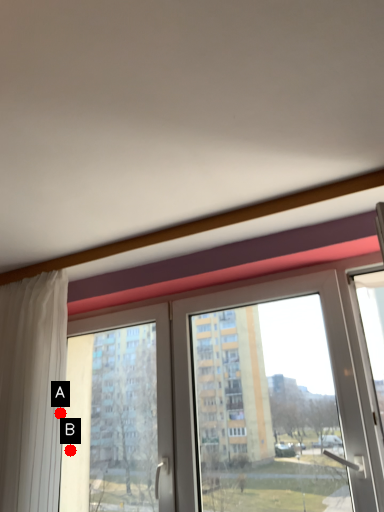
Question: Two points are circled on the image, labeled by A and B beside each circle. Which point is closer to the camera?

Choices:
 (A) A is closer
 (B) B is closer

Answer: (A)